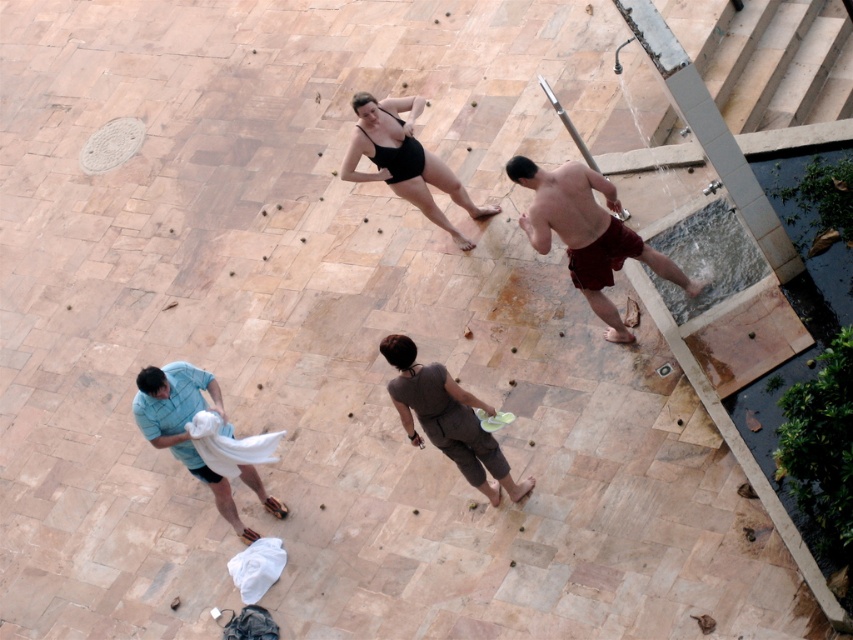
Question: Which object is positioned closest to the blue cotton shirt at lower left?

Choices:
 (A) black matte swimsuit at center
 (B) maroon fabric shorts at right
 (C) black matte bikini top at upper center
 (D) dark gray fabric towel at center

Answer: (D)

Question: In this image, where is dark gray fabric towel at center located relative to black matte swimsuit at center?

Choices:
 (A) right
 (B) left

Answer: (A)

Question: Which point is farther to the camera?

Choices:
 (A) dark gray fabric towel at center
 (B) maroon fabric shorts at right
 (C) black matte swimsuit at center

Answer: (C)

Question: Which object appears closest to the camera in this image?

Choices:
 (A) black matte bikini top at upper center
 (B) black matte swimsuit at center
 (C) dark gray fabric towel at center

Answer: (C)

Question: Is blue cotton shirt at lower left above black matte bikini top at upper center?

Choices:
 (A) no
 (B) yes

Answer: (A)

Question: Where is blue cotton shirt at lower left located in relation to black matte bikini top at upper center in the image?

Choices:
 (A) below
 (B) above

Answer: (A)